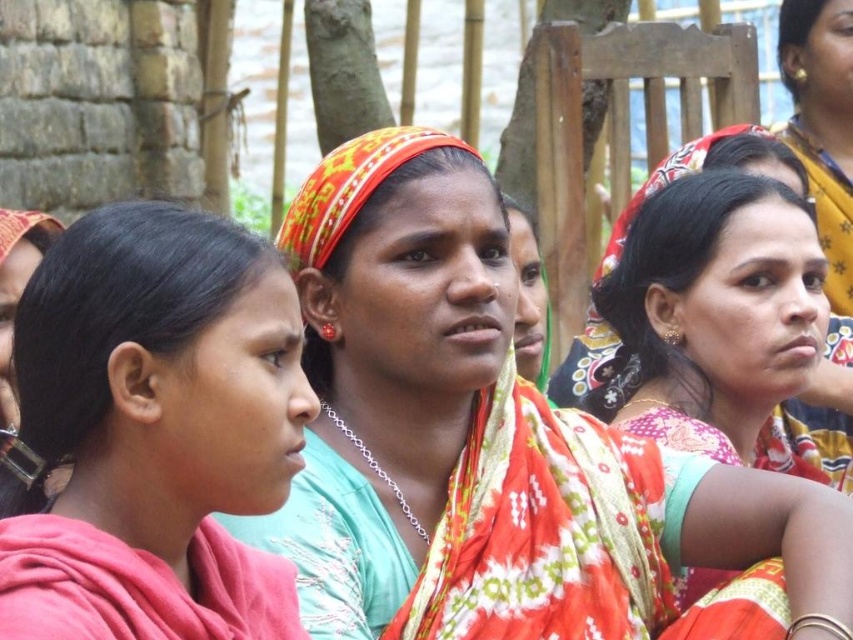
Question: Can you confirm if red and white patterned sari at center is positioned below red woven cloth at center?

Choices:
 (A) yes
 (B) no

Answer: (A)

Question: Can you confirm if floral silk saree at center is positioned above matte orange scarf at center?

Choices:
 (A) no
 (B) yes

Answer: (A)

Question: Is red and white patterned sari at center bigger than floral silk saree at center?

Choices:
 (A) yes
 (B) no

Answer: (A)

Question: Based on their relative distances, which object is farther from the red and white patterned sari at center?

Choices:
 (A) matte orange scarf at center
 (B) pink fabric headscarf at center
 (C) floral silk saree at center

Answer: (A)

Question: Based on their relative distances, which object is nearer to the red woven cloth at center?

Choices:
 (A) matte orange scarf at center
 (B) floral silk saree at center
 (C) red and white patterned sari at center
 (D) pink fabric headscarf at center

Answer: (C)

Question: Based on their relative distances, which object is nearer to the pink fabric headscarf at center?

Choices:
 (A) red woven cloth at center
 (B) floral silk saree at center
 (C) matte orange scarf at center

Answer: (A)